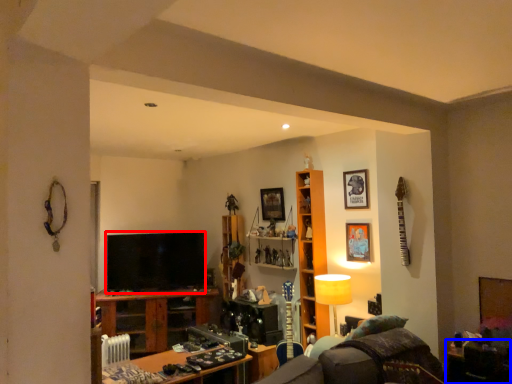
Question: Among these objects, which one is nearest to the camera, television (highlighted by a red box) or table (highlighted by a blue box)?

Choices:
 (A) television
 (B) table

Answer: (B)